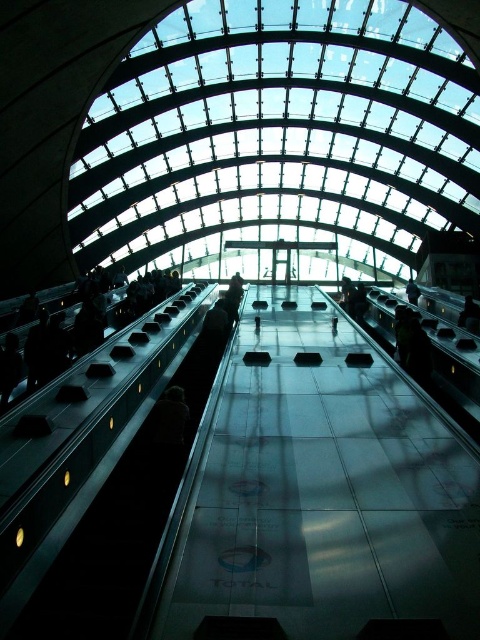
Which is above, metallic escalator at left or dark gray fabric person at center?

dark gray fabric person at center is above.

Is point (145, 344) more distant than point (135, 288)?

No, it is in front of (135, 288).

I want to click on metallic escalator at left, so click(86, 460).